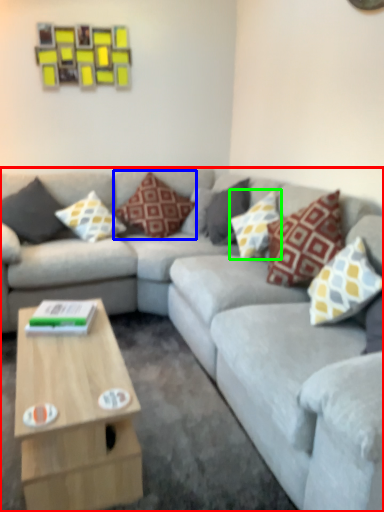
Question: Which object is positioned farthest from studio couch (highlighted by a red box)? Select from pillow (highlighted by a blue box) and pillow (highlighted by a green box).

Choices:
 (A) pillow
 (B) pillow

Answer: (A)